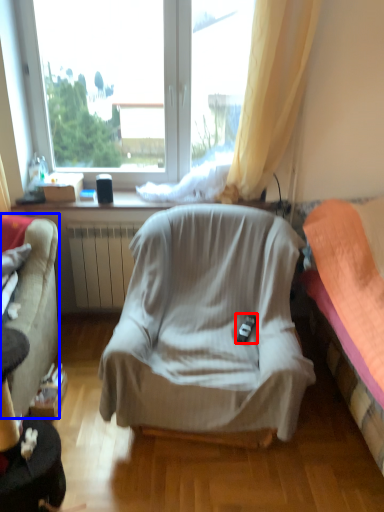
Question: Among these objects, which one is farthest to the camera, remote control (highlighted by a red box) or studio couch (highlighted by a blue box)?

Choices:
 (A) remote control
 (B) studio couch

Answer: (A)